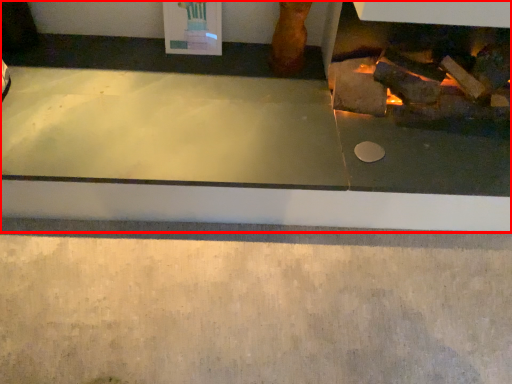
Question: From the image's perspective, where is fireplace (annotated by the red box) located relative to concrete?

Choices:
 (A) below
 (B) above

Answer: (B)